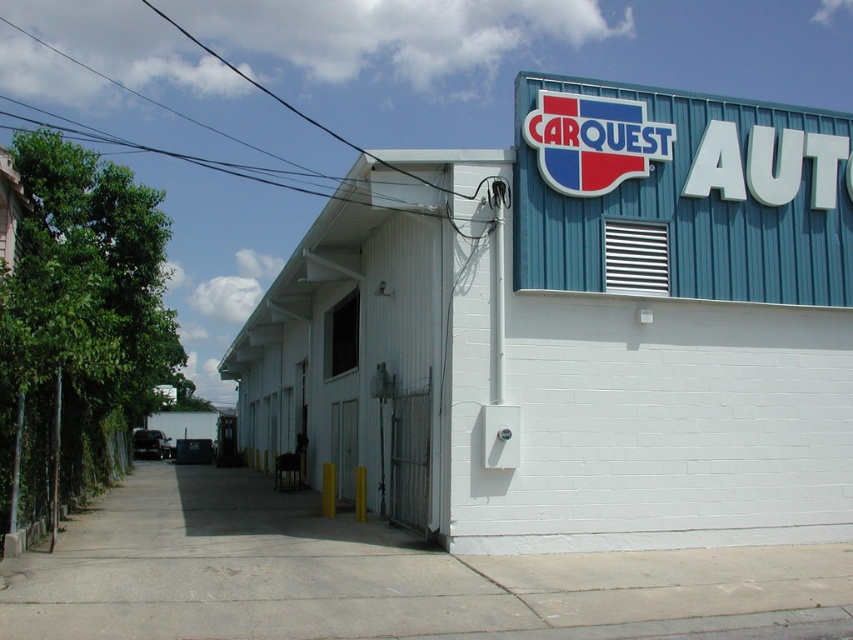
Question: Does white brick building at center appear on the right side of blue corrugated metal sign at upper right?

Choices:
 (A) yes
 (B) no

Answer: (B)

Question: Which of the following is the farthest from the observer?

Choices:
 (A) white brick building at center
 (B) blue corrugated metal sign at upper right

Answer: (B)

Question: Does white brick building at center lie in front of blue corrugated metal sign at upper right?

Choices:
 (A) no
 (B) yes

Answer: (B)

Question: Does white brick building at center have a smaller size compared to blue corrugated metal sign at upper right?

Choices:
 (A) yes
 (B) no

Answer: (B)